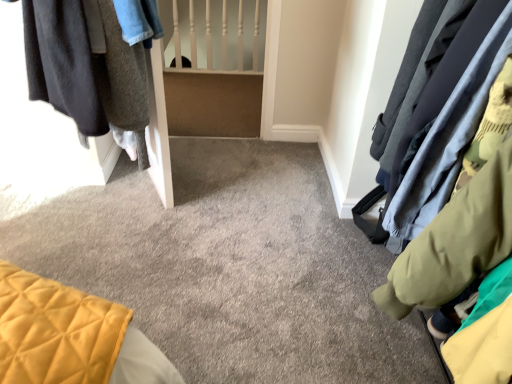
Find the location of a particular element. dark gray fabric at right is located at coordinates (442, 120).

The height and width of the screenshot is (384, 512). Describe the element at coordinates (442, 120) in the screenshot. I see `dark gray fabric at right` at that location.

Measure the distance between point (x=451, y=98) and camera.

The distance of point (x=451, y=98) from camera is 32.80 inches.

What is the approximate width of dark gray fabric at right?

dark gray fabric at right is 8.70 inches wide.

What are the coordinates of `dark gray fabric at right` in the screenshot? It's located at (442, 120).